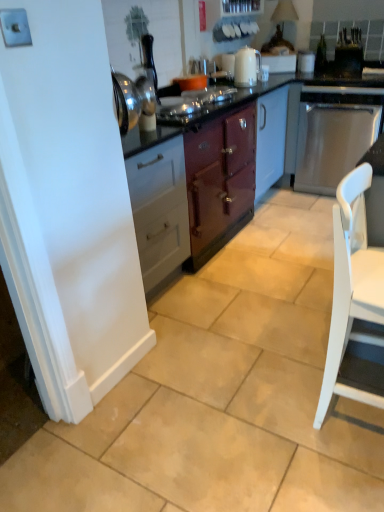
Question: Does satin black toaster at upper right, which appears as the second appliance when viewed from the left, come behind stainless steel dishwasher at right, the first kitchen appliance from the right?

Choices:
 (A) no
 (B) yes

Answer: (B)

Question: Is satin black toaster at upper right, which appears as the second appliance when viewed from the left, not within stainless steel dishwasher at right, the 2th kitchen appliance viewed from the left?

Choices:
 (A) yes
 (B) no

Answer: (A)

Question: Considering the relative sizes of satin black toaster at upper right, which appears as the second appliance when viewed from the left, and stainless steel dishwasher at right, the first kitchen appliance from the right, in the image provided, is satin black toaster at upper right, which appears as the second appliance when viewed from the left, wider than stainless steel dishwasher at right, the first kitchen appliance from the right,?

Choices:
 (A) yes
 (B) no

Answer: (B)

Question: Is satin black toaster at upper right, which is the 1th appliance in right-to-left order, taller than stainless steel dishwasher at right, the 2th kitchen appliance viewed from the left?

Choices:
 (A) yes
 (B) no

Answer: (B)

Question: From the image's perspective, is satin black toaster at upper right, which appears as the second appliance when viewed from the left, over stainless steel dishwasher at right, the 2th kitchen appliance viewed from the left?

Choices:
 (A) no
 (B) yes

Answer: (B)

Question: Is stainless steel dishwasher at right, the 2th kitchen appliance viewed from the left, taller or shorter than white matte chair at lower right?

Choices:
 (A) short
 (B) tall

Answer: (A)

Question: Based on their sizes in the image, would you say stainless steel dishwasher at right, the first kitchen appliance from the right, is bigger or smaller than white matte chair at lower right?

Choices:
 (A) small
 (B) big

Answer: (B)

Question: Is point pyautogui.click(x=379, y=110) positioned closer to the camera than point pyautogui.click(x=339, y=335)?

Choices:
 (A) farther
 (B) closer

Answer: (A)

Question: Considering the positions of stainless steel dishwasher at right, the 2th kitchen appliance viewed from the left, and white matte chair at lower right in the image, is stainless steel dishwasher at right, the 2th kitchen appliance viewed from the left, wider or thinner than white matte chair at lower right?

Choices:
 (A) thin
 (B) wide

Answer: (B)

Question: Looking at their shapes, would you say satin black toaster at upper right, which is the 1th appliance in right-to-left order, is wider or thinner than stainless steel dishwasher at right, the 2th kitchen appliance viewed from the left?

Choices:
 (A) thin
 (B) wide

Answer: (A)

Question: From the image's perspective, is satin black toaster at upper right, which is the 1th appliance in right-to-left order, positioned above or below stainless steel dishwasher at right, the first kitchen appliance from the right?

Choices:
 (A) above
 (B) below

Answer: (A)

Question: Is satin black toaster at upper right, which is the 1th appliance in right-to-left order, inside or outside of stainless steel dishwasher at right, the 2th kitchen appliance viewed from the left?

Choices:
 (A) inside
 (B) outside

Answer: (B)

Question: Based on their positions, is satin black toaster at upper right, which is the 1th appliance in right-to-left order, located to the left or right of stainless steel dishwasher at right, the first kitchen appliance from the right?

Choices:
 (A) right
 (B) left

Answer: (A)

Question: Is stainless steel dishwasher at right, the 2th kitchen appliance viewed from the left, to the left or to the right of satin black toaster at upper right, which appears as the second appliance when viewed from the left, in the image?

Choices:
 (A) right
 (B) left

Answer: (B)

Question: Looking at the image, does stainless steel dishwasher at right, the first kitchen appliance from the right, seem bigger or smaller compared to satin black toaster at upper right, which appears as the second appliance when viewed from the left?

Choices:
 (A) small
 (B) big

Answer: (B)